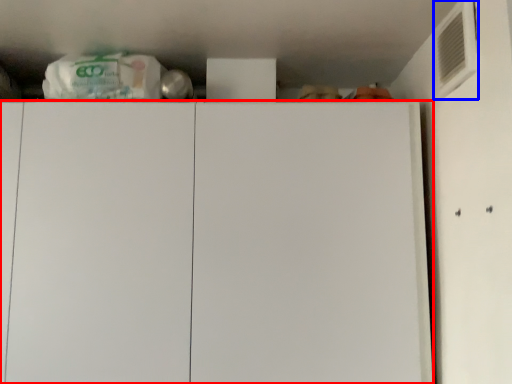
Question: Which object appears farthest to the camera in this image, cabinetry (highlighted by a red box) or air conditioning (highlighted by a blue box)?

Choices:
 (A) cabinetry
 (B) air conditioning

Answer: (A)